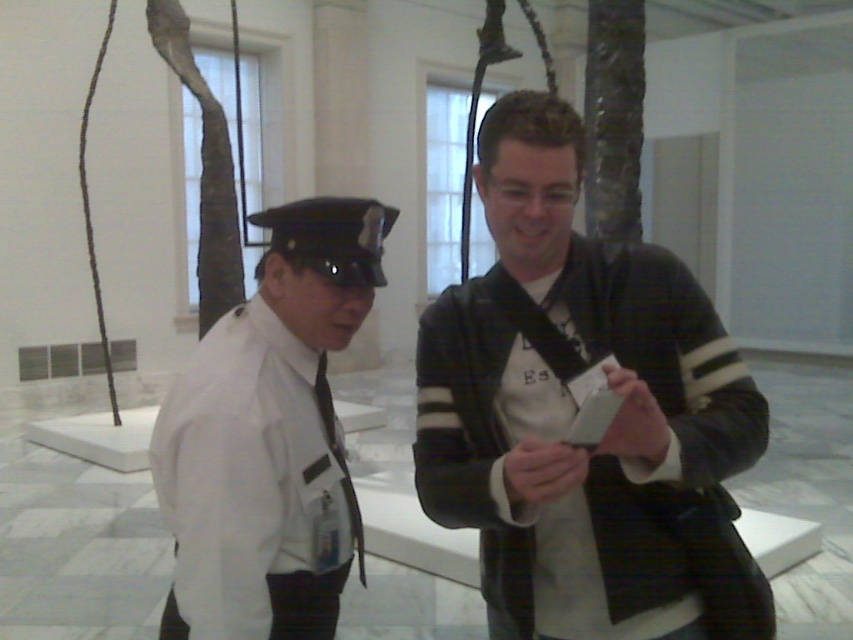
Question: Which point is farther to the camera?

Choices:
 (A) (339, 490)
 (B) (621, 428)

Answer: (A)

Question: In this image, where is black leather jacket at center located relative to white smooth shirt at left?

Choices:
 (A) above
 (B) below

Answer: (A)

Question: Does black leather jacket at center have a larger size compared to white smooth shirt at left?

Choices:
 (A) no
 (B) yes

Answer: (B)

Question: Is black leather jacket at center positioned behind white smooth shirt at left?

Choices:
 (A) no
 (B) yes

Answer: (A)